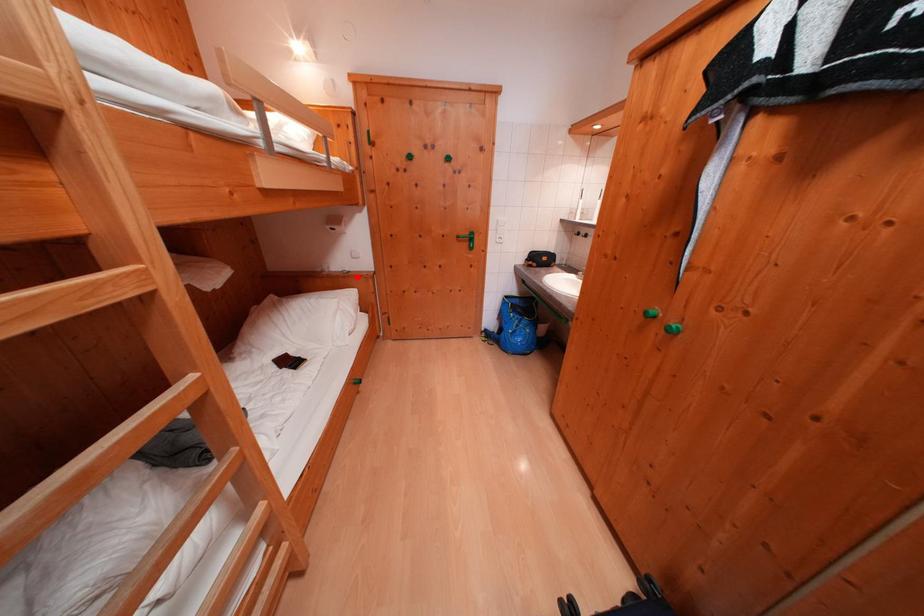
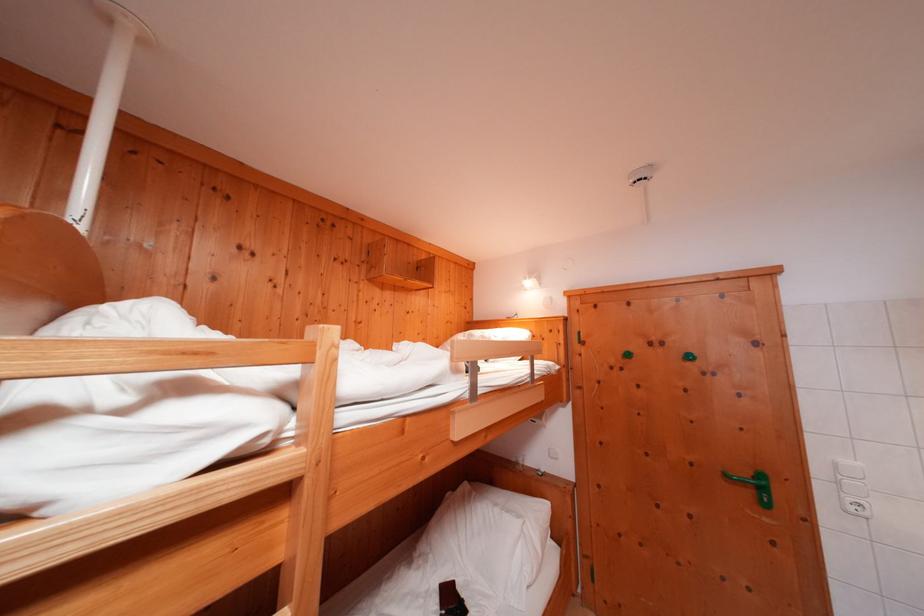
Where in the second image is the point corresponding to the highlighted location from the first image?

(552, 477)